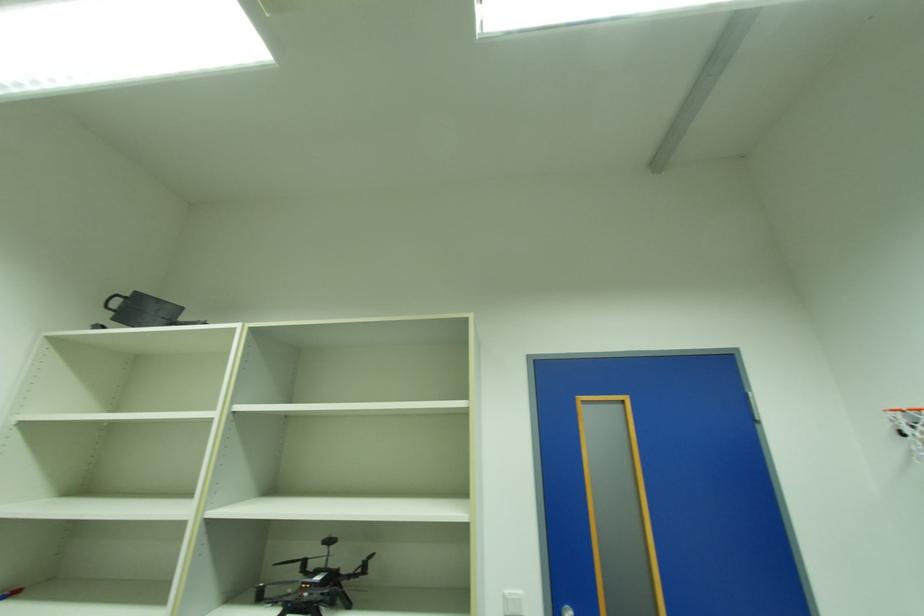
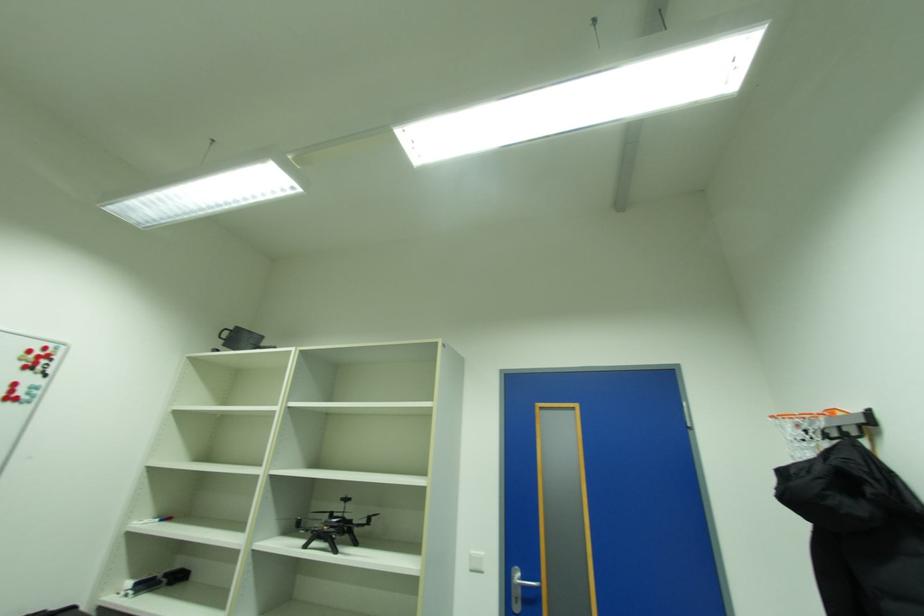
Question: The camera is either moving clockwise (left) or counter-clockwise (right) around the object. The first image is from the beginning of the video and the second image is from the end. Is the camera moving left or right when shooting the video?

Choices:
 (A) Left
 (B) Right

Answer: (B)